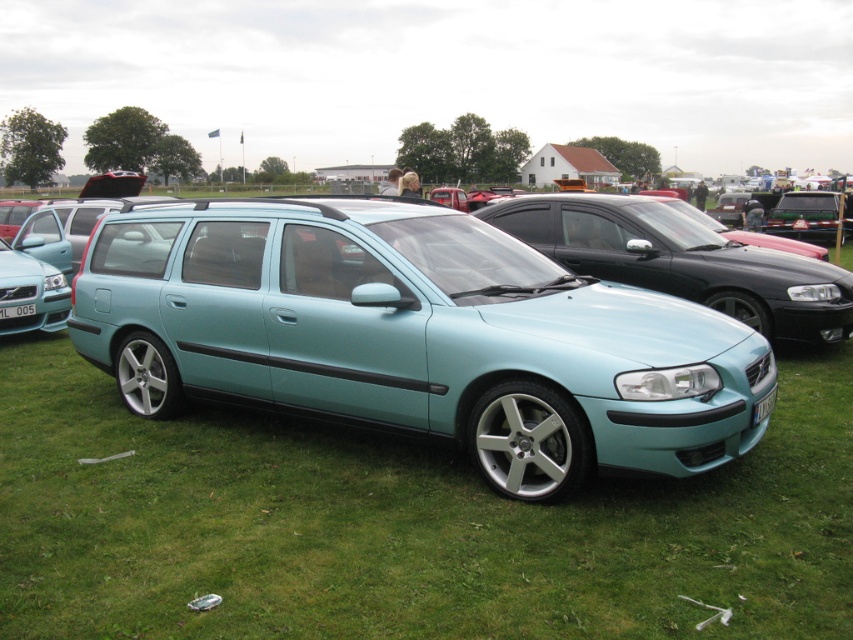
You are a photographer trying to capture the light blue metallic sedan at center and the white plastic license plate at center in a single frame. Given that your camera can only focus on objects within a 1.5 meter width, will both objects fit in the frame?

The light blue metallic sedan at center is wider than the white plastic license plate at center. Since the sedan is wider, it would occupy more space than the 1.5 meter width limit, making it impossible to fit both objects within the frame.

You are standing in front of the light blue Volvo estate car and want to take a photo that includes both the point at coordinates point (761, 403) and point (0, 312). Which point should you focus on first to ensure both are in focus?

You should focus on point (0, 312) first because it is farther from the camera than point (761, 403). By focusing on the farther point, both points will be in focus.